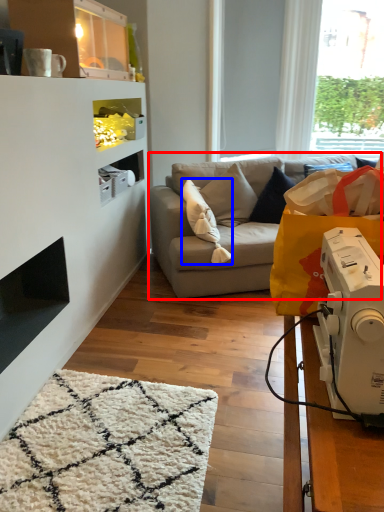
Question: Among these objects, which one is nearest to the camera, studio couch (highlighted by a red box) or pillow (highlighted by a blue box)?

Choices:
 (A) studio couch
 (B) pillow

Answer: (B)